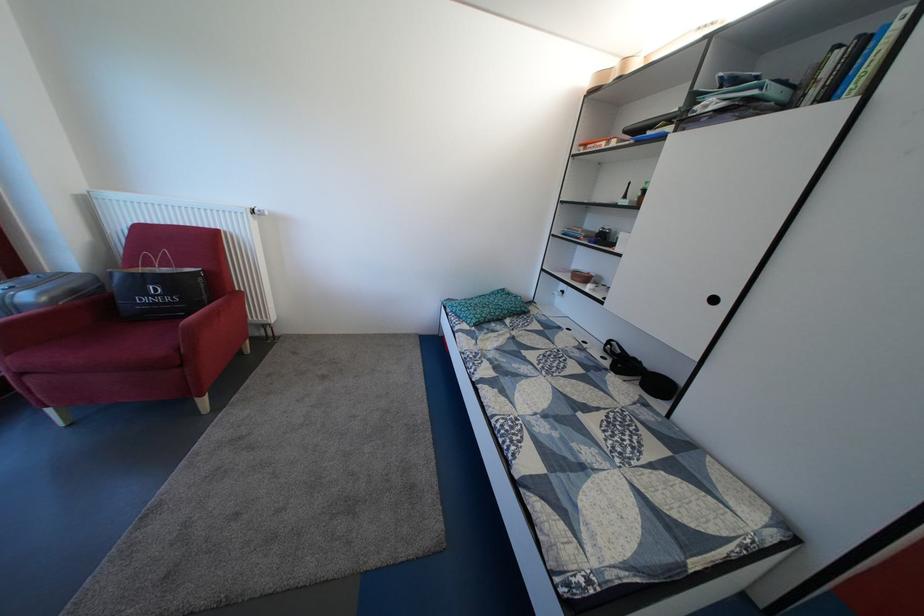
Find the location of a particular element. red chair armrest is located at coordinates (190, 334).